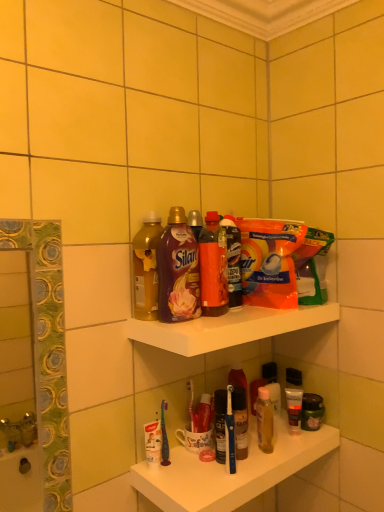
The width and height of the screenshot is (384, 512). I want to click on empty space that is ontop of white glossy shelf at upper center, marked as the 2th shelf in a bottom-to-top arrangement (from a real-world perspective), so (234, 315).